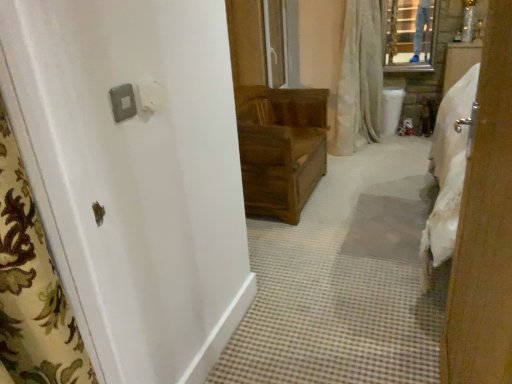
Question: In terms of width, does wooden chest at center look wider or thinner when compared to satin silver switch at upper left, acting as the 2th light switch starting from the right?

Choices:
 (A) thin
 (B) wide

Answer: (B)

Question: Is point (303, 130) positioned closer to the camera than point (113, 100)?

Choices:
 (A) farther
 (B) closer

Answer: (A)

Question: Which object is positioned closest to the wooden chest at center?

Choices:
 (A) white textured shower curtain at upper center
 (B) white plastic light switch at upper left, which is counted as the second light switch, starting from the left
 (C) satin silver switch at upper left, which ranks as the first light switch in left-to-right order
 (D) wooden door at center

Answer: (A)

Question: Based on their relative distances, which object is farther from the satin silver switch at upper left, which ranks as the first light switch in left-to-right order?

Choices:
 (A) white plastic light switch at upper left, which is counted as the second light switch, starting from the left
 (B) wooden chest at center
 (C) wooden door at center
 (D) white textured shower curtain at upper center

Answer: (D)